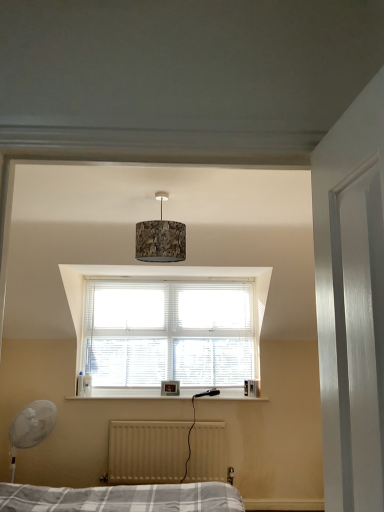
Question: Considering the relative positions of white plastic fan at lower left and textured cork lampshade at center in the image provided, is white plastic fan at lower left to the left or to the right of textured cork lampshade at center?

Choices:
 (A) left
 (B) right

Answer: (A)

Question: In terms of height, does white plastic fan at lower left look taller or shorter compared to textured cork lampshade at center?

Choices:
 (A) tall
 (B) short

Answer: (A)

Question: Based on their relative distances, which object is nearer to the white plastic fan at lower left?

Choices:
 (A) white matte radiator at lower center
 (B) textured cork lampshade at center

Answer: (A)

Question: Considering the real-world distances, which object is closest to the white matte radiator at lower center?

Choices:
 (A) white plastic fan at lower left
 (B) textured cork lampshade at center

Answer: (A)